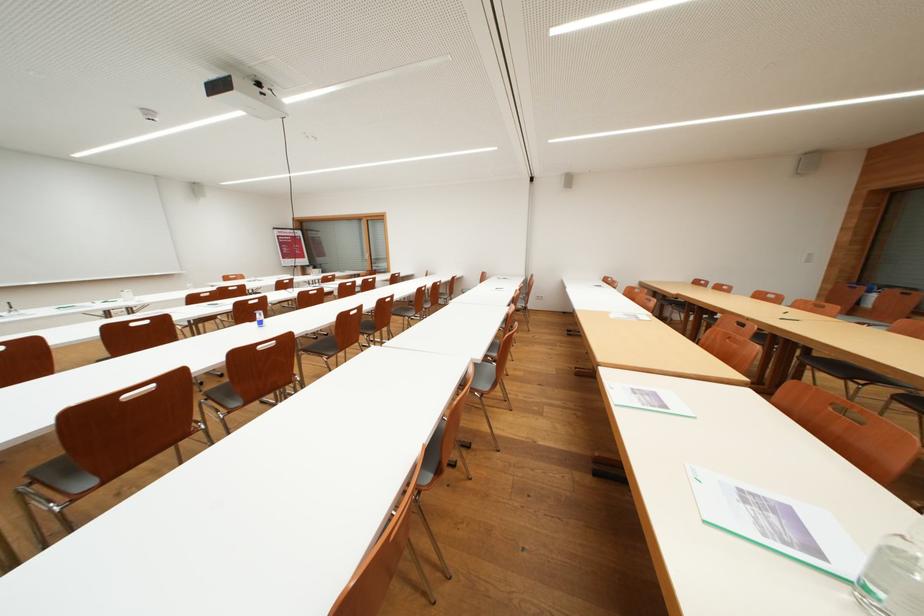
Find the location of a particular element. The image size is (924, 616). grey chair seat is located at coordinates (61, 476).